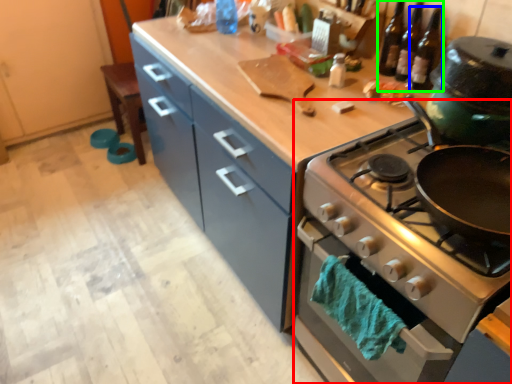
Question: Which object is positioned closest to oven (highlighted by a red box)? Select from beer bottle (highlighted by a blue box) and wine bottle (highlighted by a green box).

Choices:
 (A) beer bottle
 (B) wine bottle

Answer: (B)